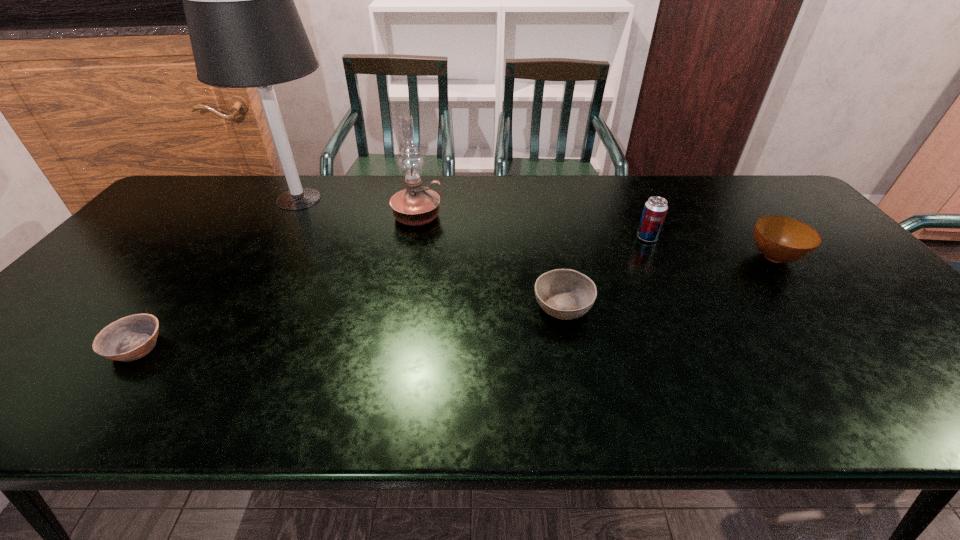
The image size is (960, 540). Find the location of `free space that satisfies the following two spatial constraints: 1. on the back side of the shortest object; 2. on the right side of the rightmost object`. free space that satisfies the following two spatial constraints: 1. on the back side of the shortest object; 2. on the right side of the rightmost object is located at coordinates (204, 257).